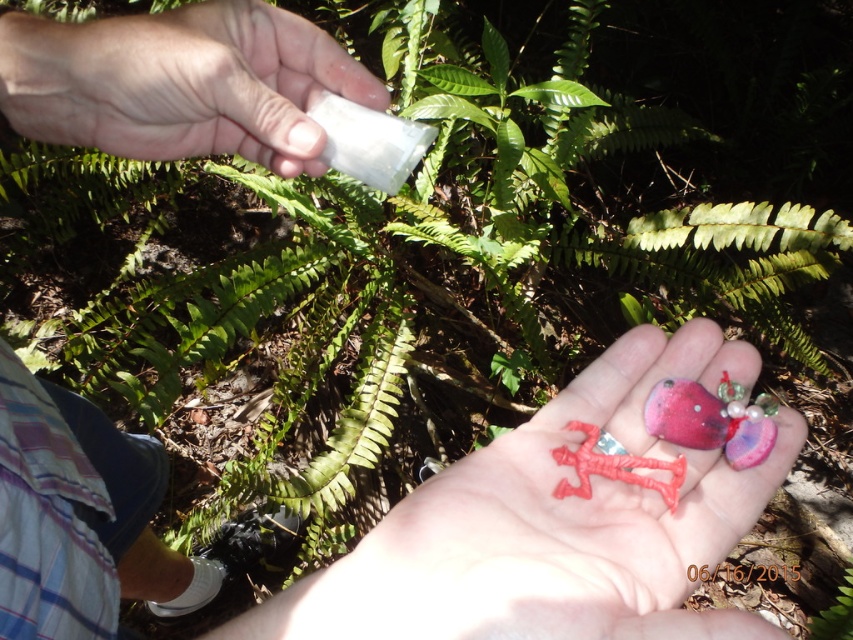
Question: Which point is closer to the camera taking this photo?

Choices:
 (A) (619, 604)
 (B) (552, 452)

Answer: (A)

Question: Considering the relative positions of matte plastic toy at center and white matte paper at upper left in the image provided, where is matte plastic toy at center located with respect to white matte paper at upper left?

Choices:
 (A) below
 (B) above

Answer: (A)

Question: Does white matte paper at upper left have a greater width compared to rubber man at center?

Choices:
 (A) yes
 (B) no

Answer: (A)

Question: Does white matte paper at upper left appear on the right side of rubber man at center?

Choices:
 (A) yes
 (B) no

Answer: (B)

Question: Considering the real-world distances, which object is closest to the matte plastic toy at center?

Choices:
 (A) rubber man at center
 (B) white matte paper at upper left

Answer: (A)

Question: Which object is the closest to the matte plastic toy at center?

Choices:
 (A) white matte paper at upper left
 (B) rubber man at center

Answer: (B)